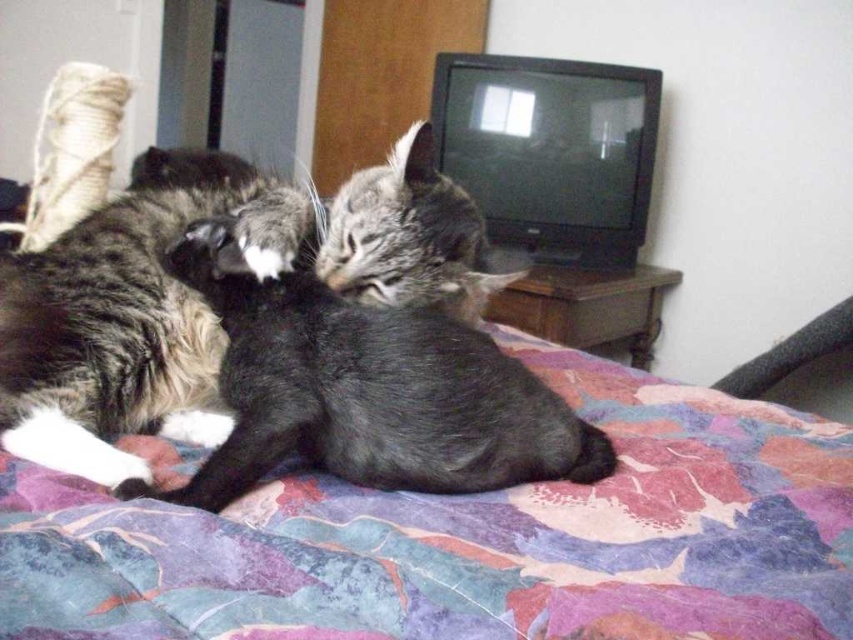
You are a photographer taking a picture of the bed and the cat. You want to focus on the floral fabric bedcover at center and the soft gray fur cat at center. Which object should you adjust your camera focus on first if you want the closer one to be sharp?

The floral fabric bedcover at center is closer to the viewer than the soft gray fur cat at center, so you should focus on the floral fabric bedcover at center first to ensure it is sharp.

You are a photographer trying to capture a closeup of both the soft gray fur cat at center and the tabby fur cat at center. Since you want to focus on their faces, which cat should you adjust your camera to prioritize focusing on first based on their positions?

The soft gray fur cat at center is positioned on the right side of tabby fur cat at center. To focus on both faces, prioritize the tabby fur cat at center since it is closer to the left, allowing the camera to adjust from left to right for optimal focus on both.

You are a photographer setting up a shot of the bed with both cats. You need to place a small prop exactly at the point marked as point (469, 538). What will the prop be placed on?

The prop will be placed on the floral fabric bedcover at center, as that is what is located at point (469, 538).